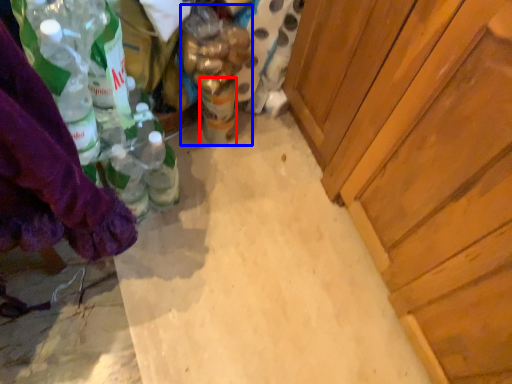
Question: Which object appears farthest to the camera in this image, beverage (highlighted by a red box) or bottle (highlighted by a blue box)?

Choices:
 (A) beverage
 (B) bottle

Answer: (A)